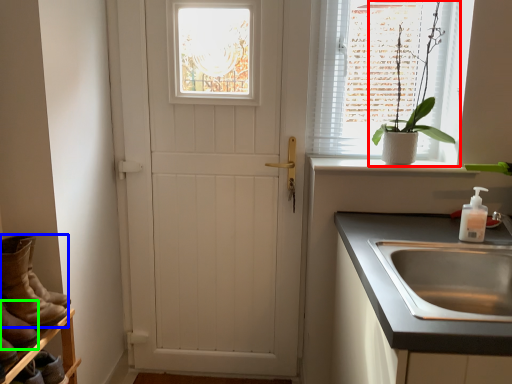
Question: Estimate the real-world distances between objects in this image. Which object is farther from houseplant (highlighted by a red box), footwear (highlighted by a blue box) or boot (highlighted by a green box)?

Choices:
 (A) footwear
 (B) boot

Answer: (B)